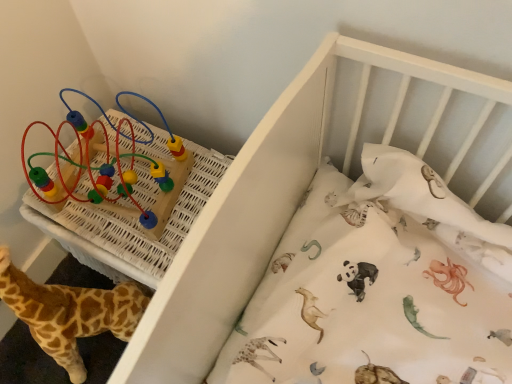
Question: Is white wooden crib at upper center wider than soft plush giraffe at lower left?

Choices:
 (A) yes
 (B) no

Answer: (A)

Question: Is white wooden crib at upper center shorter than soft plush giraffe at lower left?

Choices:
 (A) yes
 (B) no

Answer: (B)

Question: Is white wooden crib at upper center positioned with its back to soft plush giraffe at lower left?

Choices:
 (A) yes
 (B) no

Answer: (B)

Question: Does white wooden crib at upper center appear on the right side of soft plush giraffe at lower left?

Choices:
 (A) yes
 (B) no

Answer: (A)

Question: Is white wooden crib at upper center smaller than soft plush giraffe at lower left?

Choices:
 (A) yes
 (B) no

Answer: (B)

Question: Is the depth of white wooden crib at upper center less than that of soft plush giraffe at lower left?

Choices:
 (A) yes
 (B) no

Answer: (A)

Question: Is multicolored plastic beads at upper left shorter than white wooden crib at upper center?

Choices:
 (A) no
 (B) yes

Answer: (B)

Question: Is white wooden crib at upper center inside multicolored plastic beads at upper left?

Choices:
 (A) yes
 (B) no

Answer: (B)

Question: Considering the relative sizes of multicolored plastic beads at upper left and white wooden crib at upper center in the image provided, is multicolored plastic beads at upper left smaller than white wooden crib at upper center?

Choices:
 (A) yes
 (B) no

Answer: (A)

Question: Is the depth of multicolored plastic beads at upper left greater than that of white wooden crib at upper center?

Choices:
 (A) no
 (B) yes

Answer: (B)

Question: Does multicolored plastic beads at upper left come in front of white wooden crib at upper center?

Choices:
 (A) no
 (B) yes

Answer: (A)

Question: Is multicolored plastic beads at upper left aimed at white wooden crib at upper center?

Choices:
 (A) yes
 (B) no

Answer: (B)

Question: Is soft plush giraffe at lower left behind multicolored plastic beads at upper left?

Choices:
 (A) no
 (B) yes

Answer: (A)